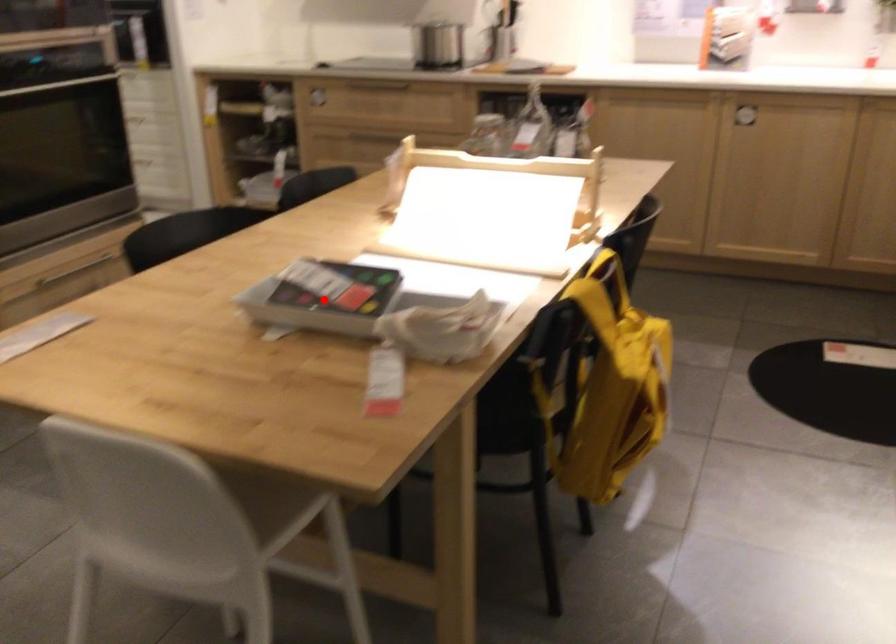
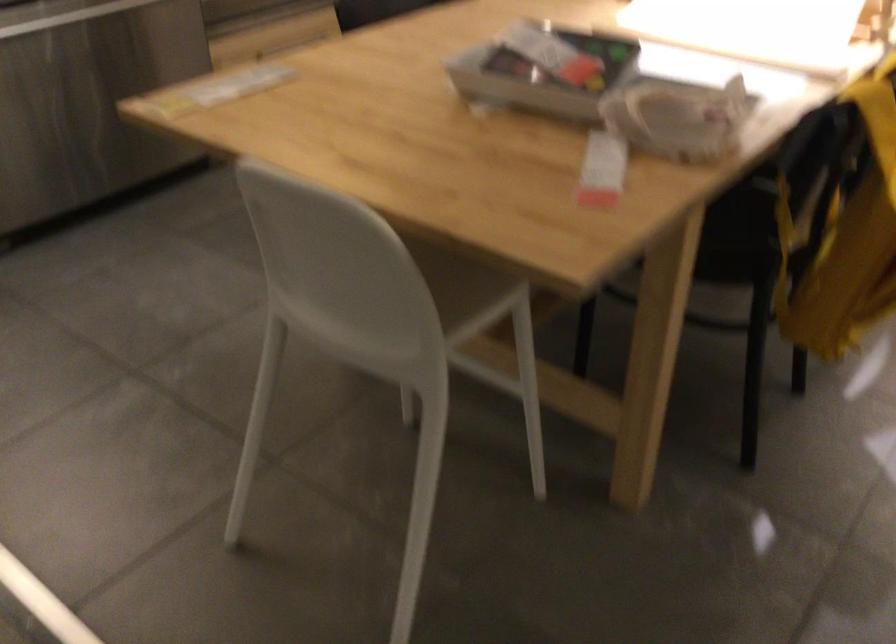
Question: I am providing you with two images of the same scene from different viewpoints. A red point is shown in image1. For the corresponding object point in image2, is it positioned nearer or farther from the camera?

Choices:
 (A) Nearer
 (B) Farther

Answer: (A)